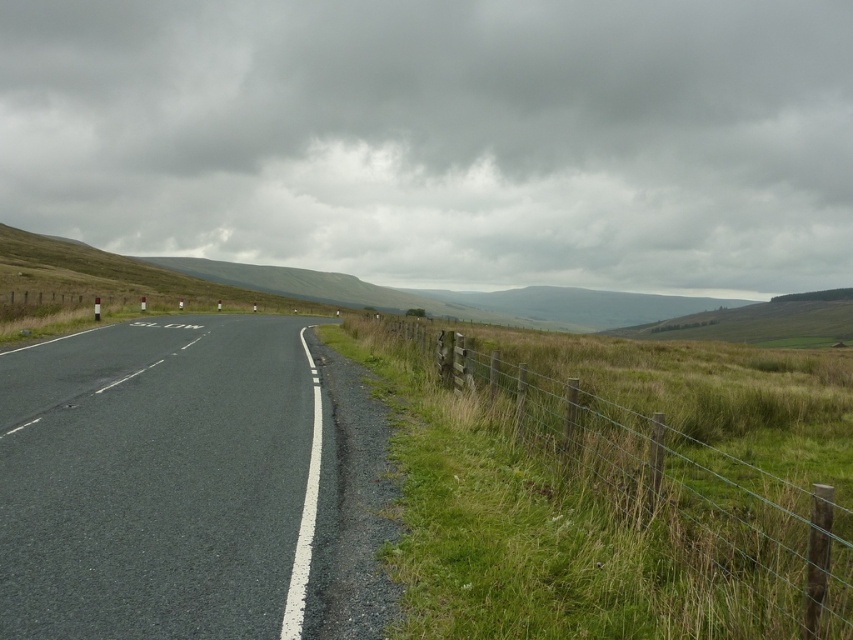
You are a delivery driver approaching the rural road scene. You need to know if the asphalt road at center is positioned below the green wire fence at right to plan your route. Can you confirm this?

Yes, the asphalt road at center is located below the green wire fence at right according to the description.

You are standing at the point labeled point (163, 481). Which direction should you walk to reach the wooden fence on the right side of the road?

The point (163, 481) marks the asphalt road at center, so you should walk to the right to reach the wooden fence on the right side of the road.

You are standing at the edge of the asphalt road at center. A car is approaching from the direction of the curve. If the car is traveling at 30 km per hour, how many seconds will it take for the car to reach you?

The distance of asphalt road at center from camera is 4.06 meters. The car is approaching from the curve, so the actual distance is longer than 4.06 meters. Therefore, it is impossible to determine the exact time without knowing the full distance.